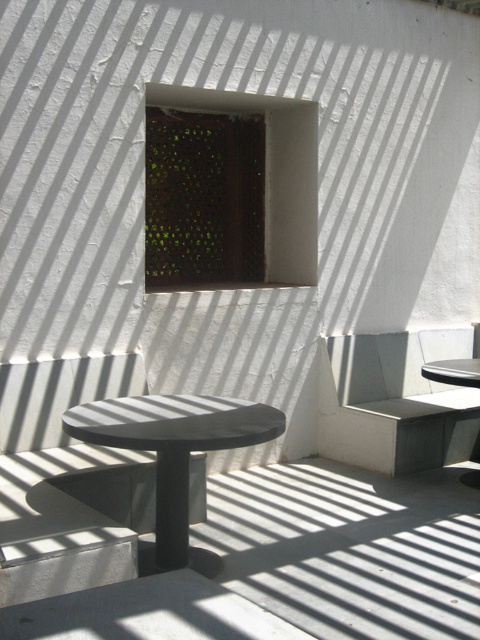
You are planning to host a small gathering and need to seat guests comfortably. Given the concrete bench at right and the smooth gray table at right, which object has a larger seating capacity based on their widths?

The concrete bench at right has a larger seating capacity because its width surpasses that of the smooth gray table at right.

You are standing at the point with coordinates point [459,381] and want to walk to point [359,381]. Which direction should you move?

You should move forward because point [359,381] is behind point [459,381], so moving toward it would require going in the forward direction.